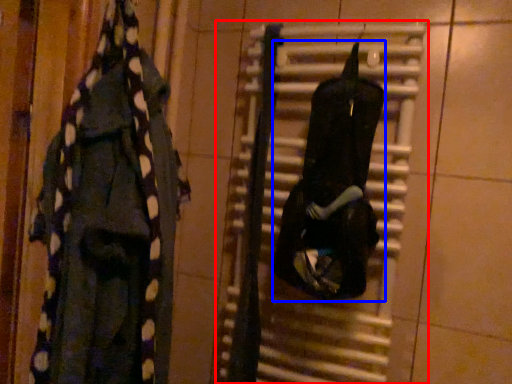
Question: Which point is further to the camera, radiator (highlighted by a red box) or clothing (highlighted by a blue box)?

Choices:
 (A) radiator
 (B) clothing

Answer: (A)